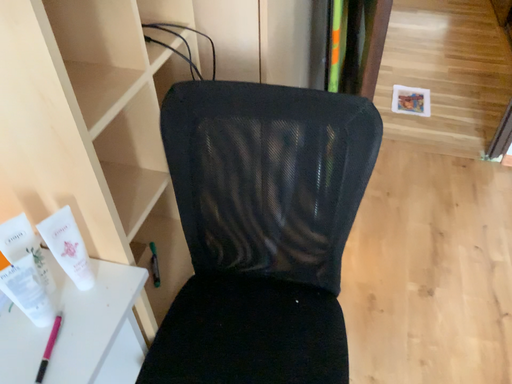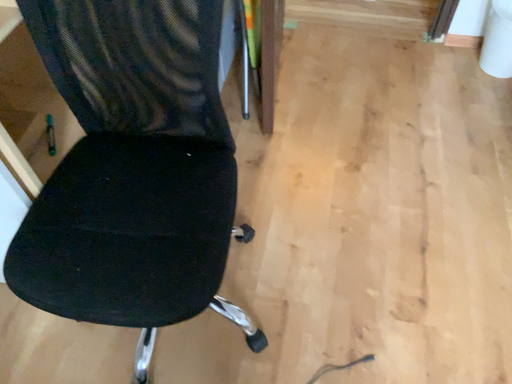
Question: How did the camera likely rotate when shooting the video?

Choices:
 (A) rotated upward
 (B) rotated downward

Answer: (B)